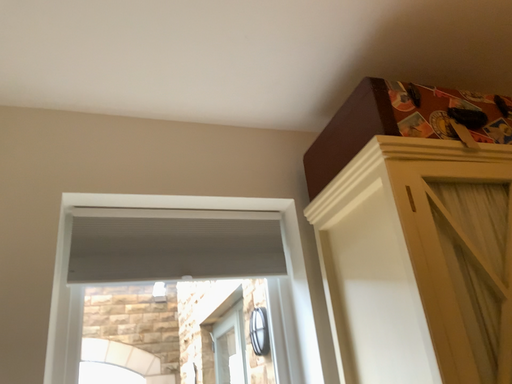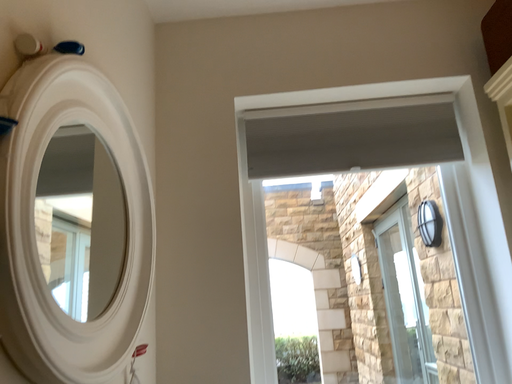
Question: Which way did the camera rotate in the video?

Choices:
 (A) rotated downward
 (B) rotated upward

Answer: (A)